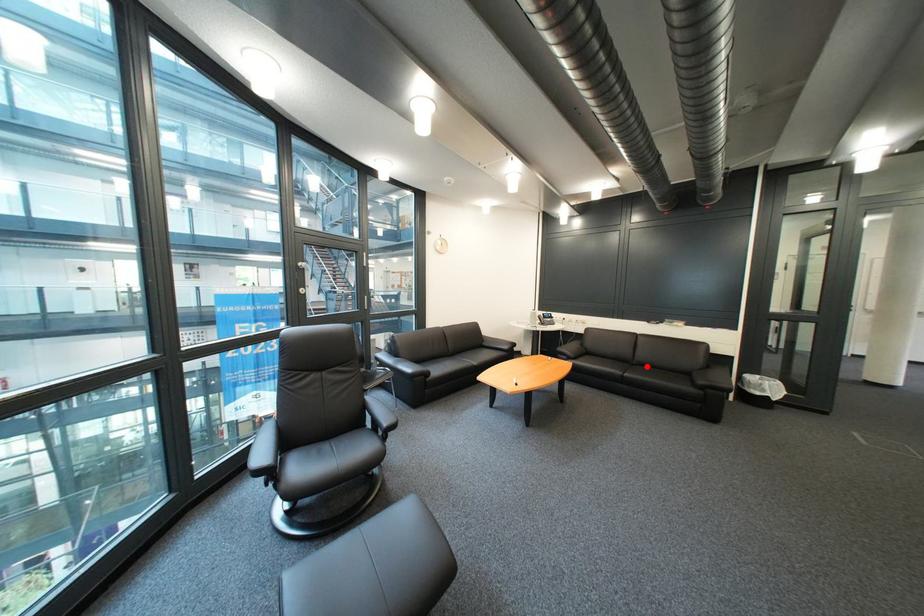
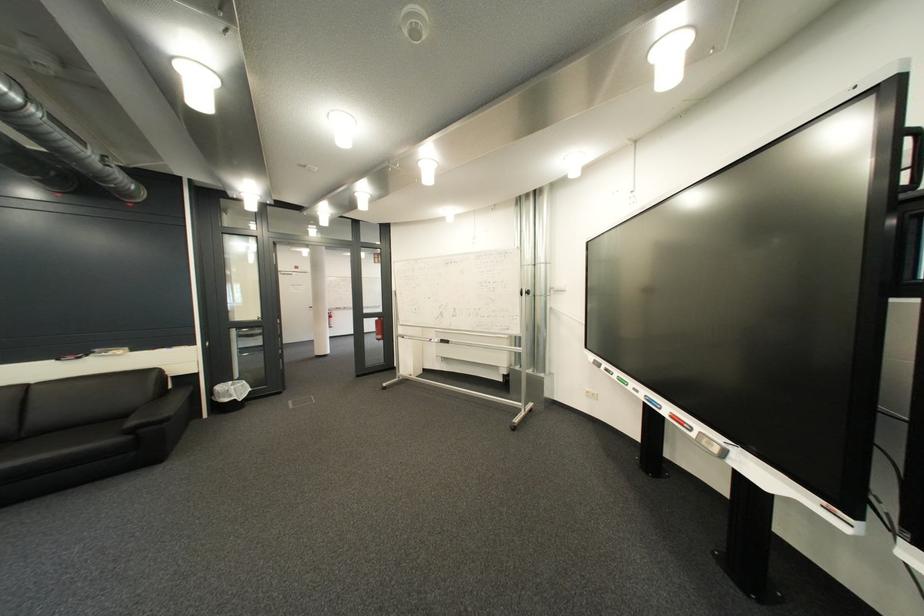
The point at the highlighted location is marked in the first image. Where is the corresponding point in the second image?

(35, 440)